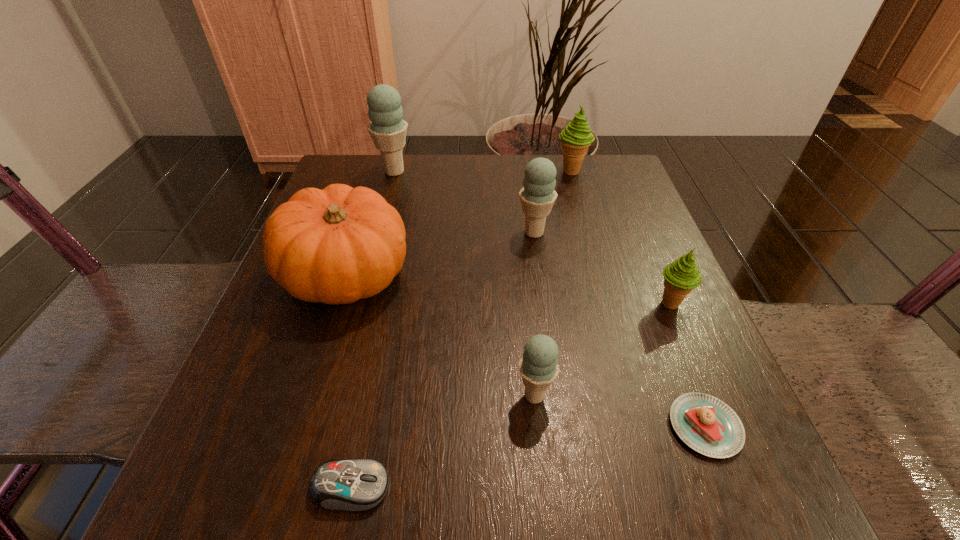
At what (x,y) coordinates should I click in order to perform the action: click on object that is at the far right corner. Please return your answer as a coordinate pair (x, y). The width and height of the screenshot is (960, 540). Looking at the image, I should click on (576, 138).

This screenshot has width=960, height=540. Identify the location of object present at the near right corner. pyautogui.click(x=706, y=424).

In the image, there is a desktop. Where is `vacant space at the far edge`? vacant space at the far edge is located at coordinates (495, 157).

Locate an element on the screen. Image resolution: width=960 pixels, height=540 pixels. free space at the left edge of the desktop is located at coordinates (346, 339).

In the image, there is a desktop. Find the location of `vacant space at the right edge`. vacant space at the right edge is located at coordinates (601, 290).

Identify the location of vacant region at the far left corner of the desktop. (382, 177).

This screenshot has width=960, height=540. Identify the location of free spot between the fourth ice cream from left to right and the shortest object. (638, 299).

The width and height of the screenshot is (960, 540). In order to click on vacant space that's between the orange pumpkin and the nearest ice cream in this screenshot , I will do `click(441, 335)`.

Where is `vacant space in between the nearest blue ice cream and the nearest object`? vacant space in between the nearest blue ice cream and the nearest object is located at coordinates (443, 441).

The image size is (960, 540). What are the coordinates of `free space between the right green icecream and the nearest object` in the screenshot? It's located at (511, 396).